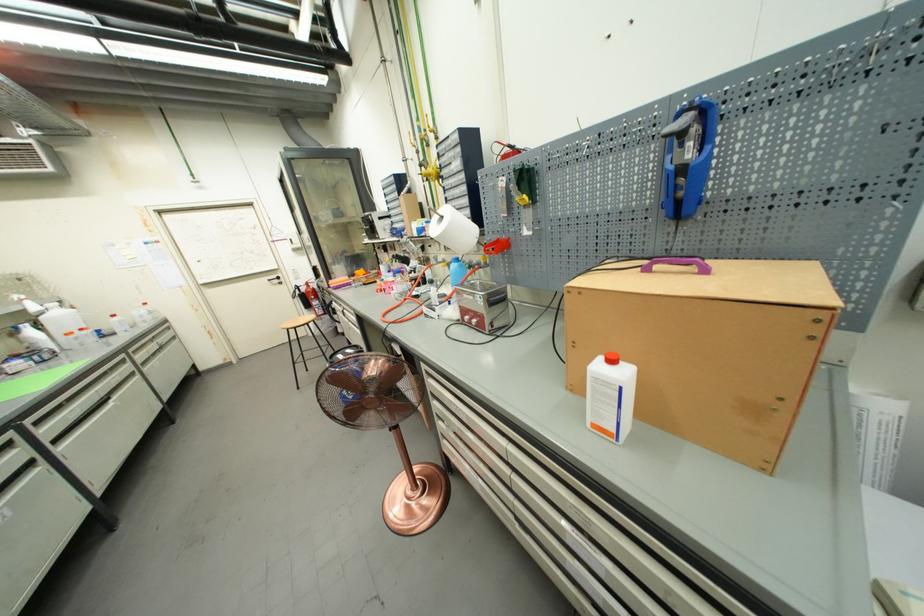
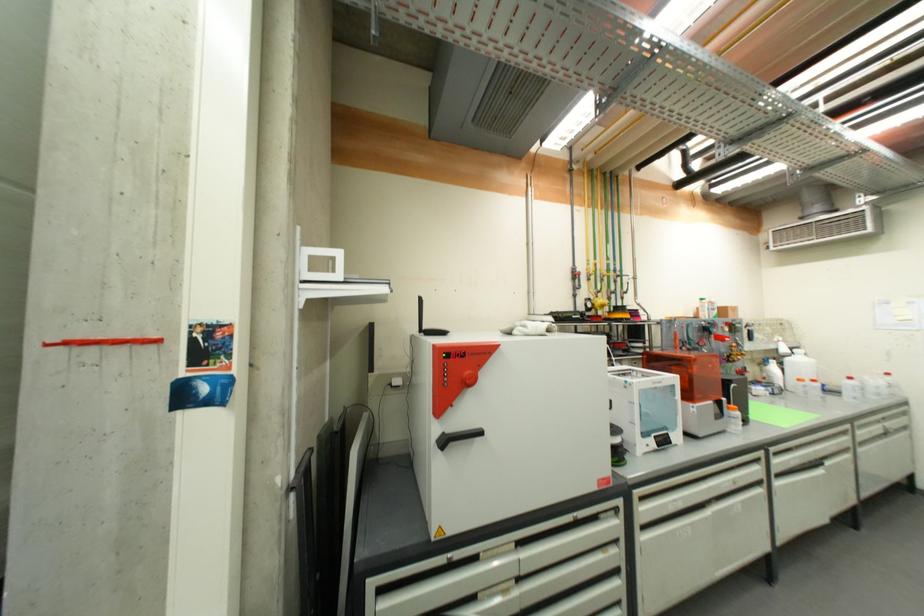
Where in the second image is the point corresponding to the point at 146,363 from the first image?

(864, 442)